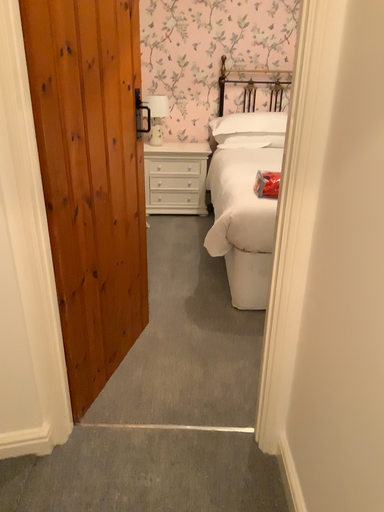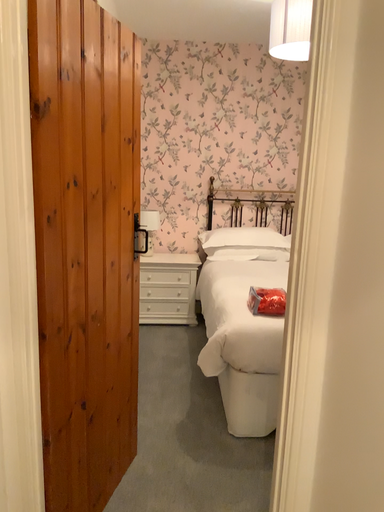
Question: How did the camera likely rotate when shooting the video?

Choices:
 (A) rotated downward
 (B) rotated upward

Answer: (B)